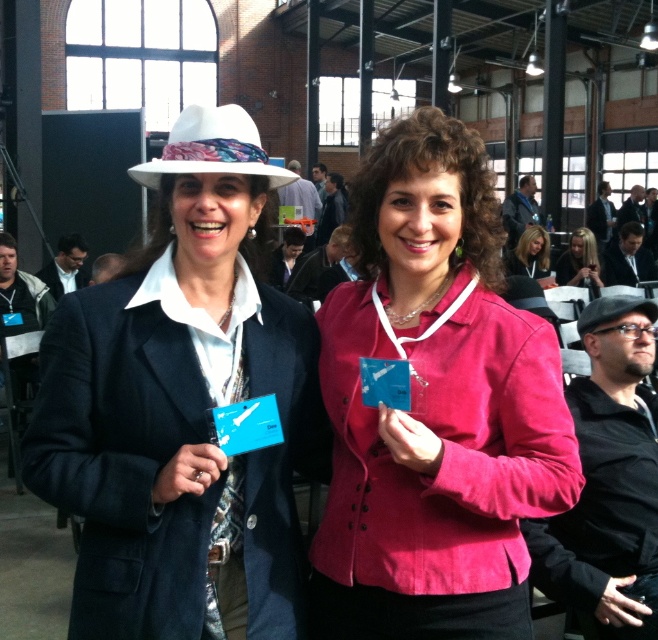
From the picture: You are at a conference and need to locate the matte black blazer at center. According to the coordinates provided, where exactly is it positioned in the image?

The matte black blazer at center is located at point coordinates of (182, 410).

You are an event organizer at the conference venue. You need to determine the correct order of the pink fabric jacket at center and the matte pink blazer at center for a photo shoot. Which one should be placed higher to maintain the spatial arrangement seen in the image?

The matte pink blazer at center should be placed higher because the pink fabric jacket at center is below it in the image.